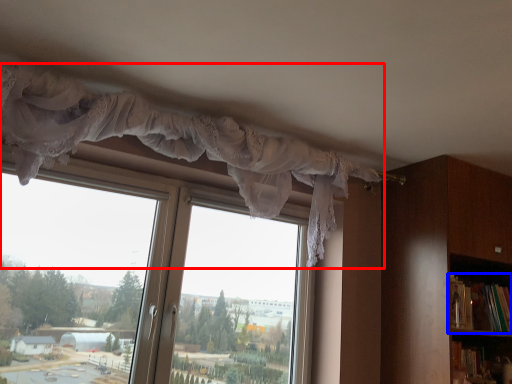
Question: Which of the following is the closest to the observer, curtain (highlighted by a red box) or book (highlighted by a blue box)?

Choices:
 (A) curtain
 (B) book

Answer: (A)